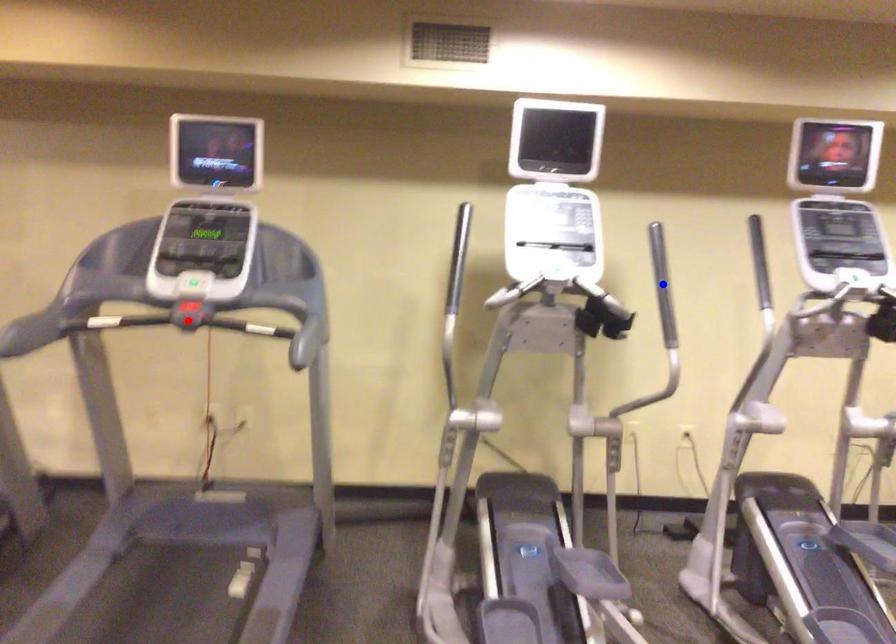
Question: Two points are marked on the image. Which point is closer to the camera?

Choices:
 (A) Blue point is closer.
 (B) Red point is closer.

Answer: (B)